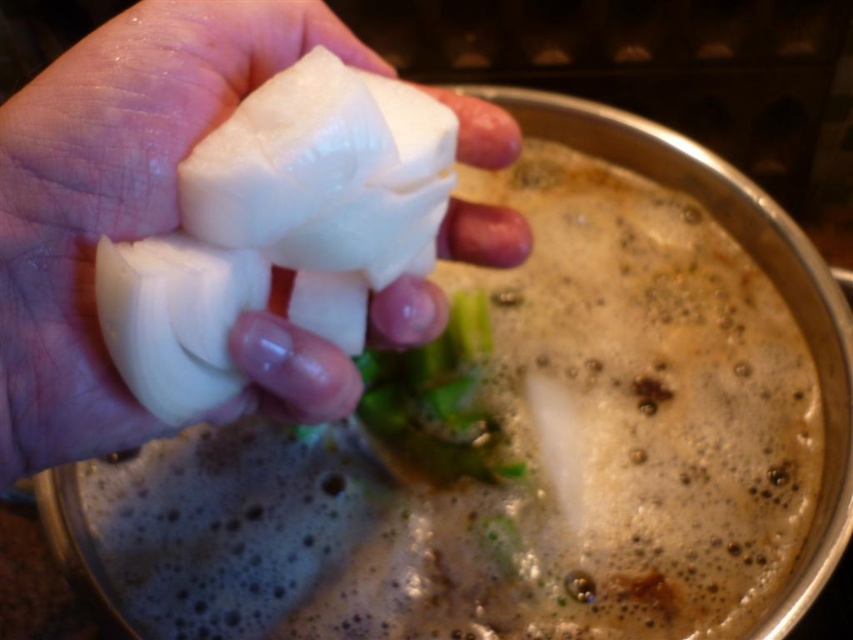
Can you confirm if white matte onion at center is positioned above green leafy at center?

Yes.

Looking at this image, is white matte onion at center to the left of green leafy at center from the viewer's perspective?

Correct, you'll find white matte onion at center to the left of green leafy at center.

This screenshot has height=640, width=853. Identify the location of white matte onion at center. (114, 195).